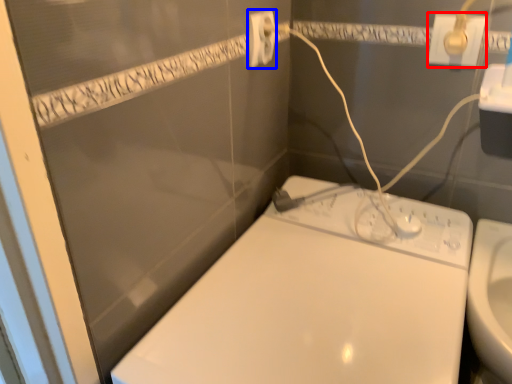
Question: Which point is further to the camera, power plugs and sockets (highlighted by a red box) or power plugs and sockets (highlighted by a blue box)?

Choices:
 (A) power plugs and sockets
 (B) power plugs and sockets

Answer: (A)